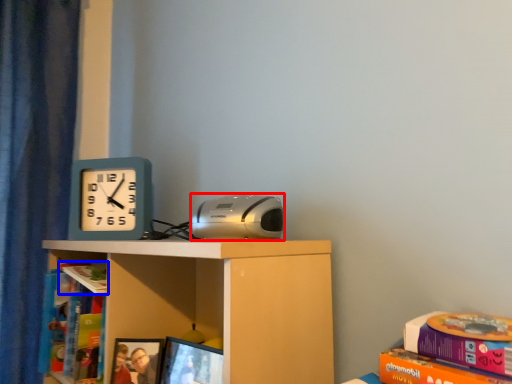
Question: Which object is further to the camera taking this photo, stereo (highlighted by a red box) or book (highlighted by a blue box)?

Choices:
 (A) stereo
 (B) book

Answer: (B)